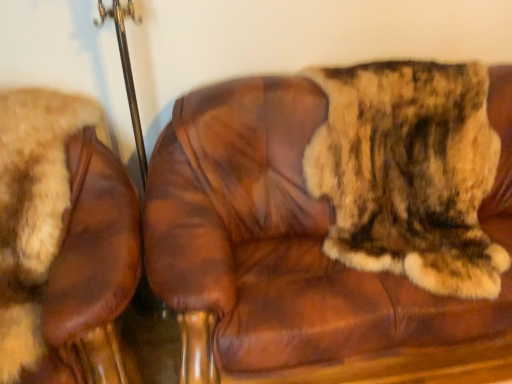
Question: Looking at their shapes, would you say brown leather chair at center, the 2th chair in the left-to-right sequence, is wider or thinner than brown leather chair at left, positioned as the second chair in right-to-left order?

Choices:
 (A) thin
 (B) wide

Answer: (A)

Question: Is brown leather chair at center, the 2th chair in the left-to-right sequence, in front of or behind brown leather chair at left, the 1th chair in the left-to-right sequence, in the image?

Choices:
 (A) behind
 (B) front

Answer: (A)

Question: Considering the real-world distances, which object is closest to the brown leather chair at center, the 2th chair in the left-to-right sequence?

Choices:
 (A) brown leather chair at left, positioned as the second chair in right-to-left order
 (B) fuzzy brown fur at right

Answer: (B)

Question: Which is nearer to the fuzzy brown fur at right?

Choices:
 (A) brown leather chair at left, positioned as the second chair in right-to-left order
 (B) brown leather chair at center, the 2th chair in the left-to-right sequence

Answer: (B)